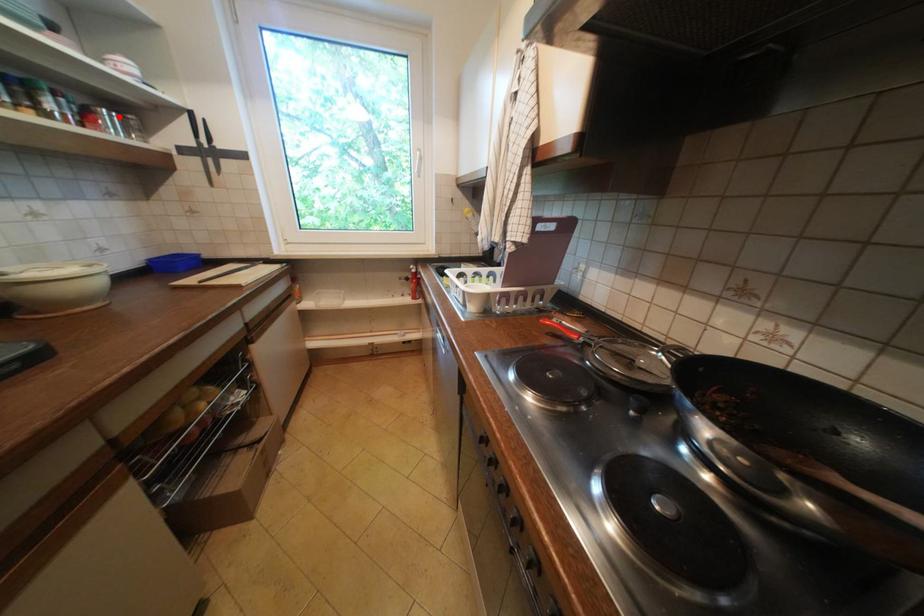
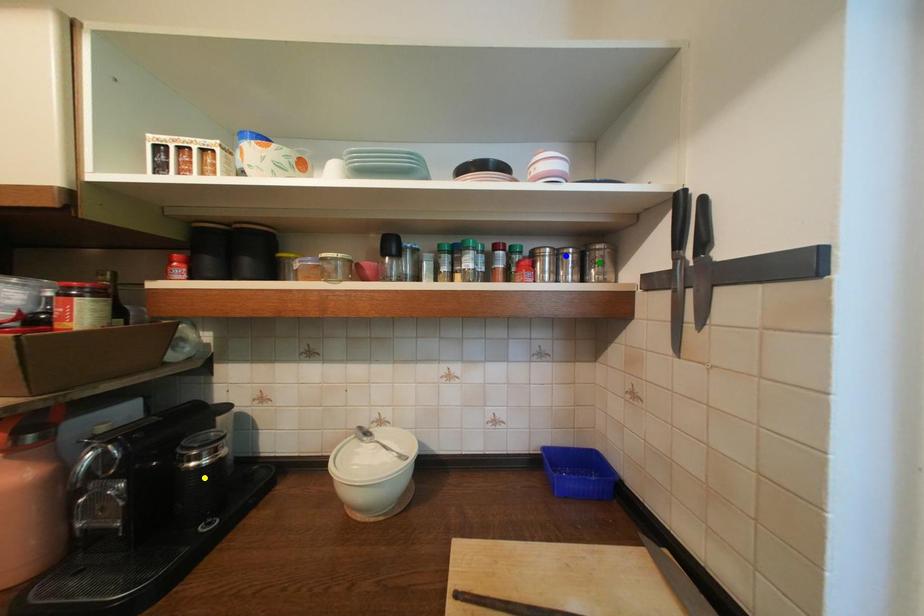
Question: I am providing you with two images of the same scene from different viewpoints. A red point is marked on the first image. You are given multiple points on the second image. Which mark in image 2 goes with the point in image 1?

Choices:
 (A) green point
 (B) blue point
 (C) yellow point

Answer: (B)